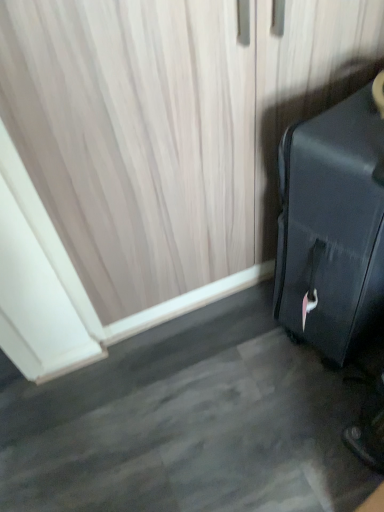
Question: In the image, is black matte suitcase at right positioned in front of or behind matte beige curtain at upper left?

Choices:
 (A) behind
 (B) front

Answer: (B)

Question: In terms of width, does black matte suitcase at right look wider or thinner when compared to matte beige curtain at upper left?

Choices:
 (A) thin
 (B) wide

Answer: (B)

Question: Is black matte suitcase at right situated inside matte beige curtain at upper left or outside?

Choices:
 (A) outside
 (B) inside

Answer: (A)

Question: From the image's perspective, is matte beige curtain at upper left positioned above or below black matte suitcase at right?

Choices:
 (A) below
 (B) above

Answer: (B)

Question: In terms of size, does matte beige curtain at upper left appear bigger or smaller than black matte suitcase at right?

Choices:
 (A) big
 (B) small

Answer: (B)

Question: Relative to black matte suitcase at right, is matte beige curtain at upper left in front or behind?

Choices:
 (A) front
 (B) behind

Answer: (B)

Question: Looking at their shapes, would you say matte beige curtain at upper left is wider or thinner than black matte suitcase at right?

Choices:
 (A) wide
 (B) thin

Answer: (B)